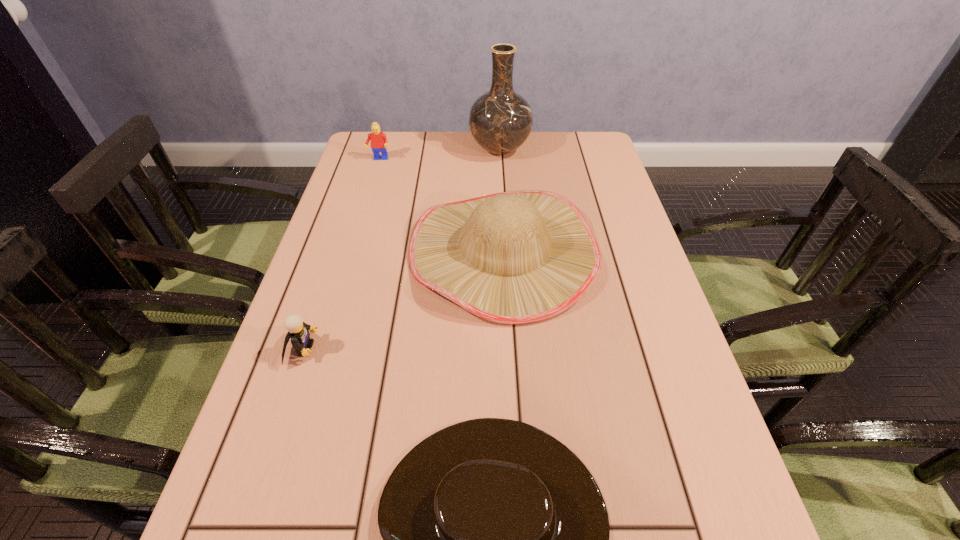
Where is `free space between the farther Lego and the nearer Lego`? The image size is (960, 540). free space between the farther Lego and the nearer Lego is located at coordinates (341, 254).

This screenshot has width=960, height=540. Identify the location of unoccupied area between the farther Lego and the second nearest object. (341, 254).

The width and height of the screenshot is (960, 540). Find the location of `vacant space in between the fourth farthest object and the vase`. vacant space in between the fourth farthest object and the vase is located at coordinates (401, 249).

The image size is (960, 540). I want to click on the third closest object to the third nearest object, so click(x=379, y=143).

I want to click on object that stands as the third closest to the vase, so click(298, 331).

At what (x,y) coordinates should I click in order to perform the action: click on free space that satisfies the following two spatial constraints: 1. on the front-facing side of the farther Lego; 2. on the left side of the sunhat. Please return your answer as a coordinate pair (x, y). This screenshot has width=960, height=540. Looking at the image, I should click on (351, 252).

You are a GUI agent. You are given a task and a screenshot of the screen. Output one action in this format:
    pyautogui.click(x=<x>, y=<y>)
    Task: Click on the vacant area that satisfies the following two spatial constraints: 1. on the front-facing side of the third tallest object; 2. on the front-facing side of the second nearest object
    The height and width of the screenshot is (540, 960).
    Given the screenshot: What is the action you would take?
    pyautogui.click(x=323, y=349)

This screenshot has height=540, width=960. I want to click on vacant position in the image that satisfies the following two spatial constraints: 1. on the front-facing side of the farther Lego; 2. on the left side of the third farthest object, so click(351, 252).

What are the coordinates of `vacant space that satisfies the following two spatial constraints: 1. on the front-facing side of the farther Lego; 2. on the front-facing side of the nearer Lego` in the screenshot? It's located at (323, 349).